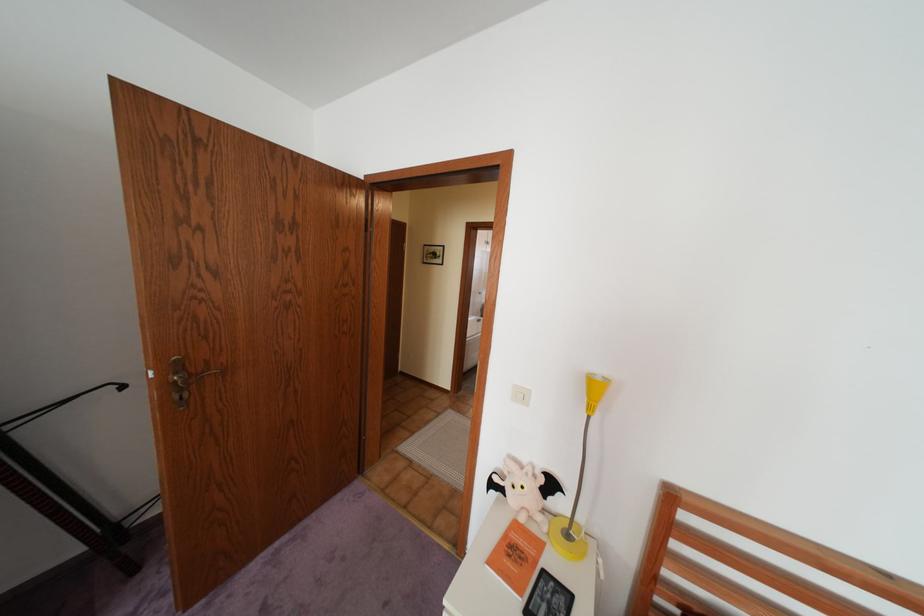
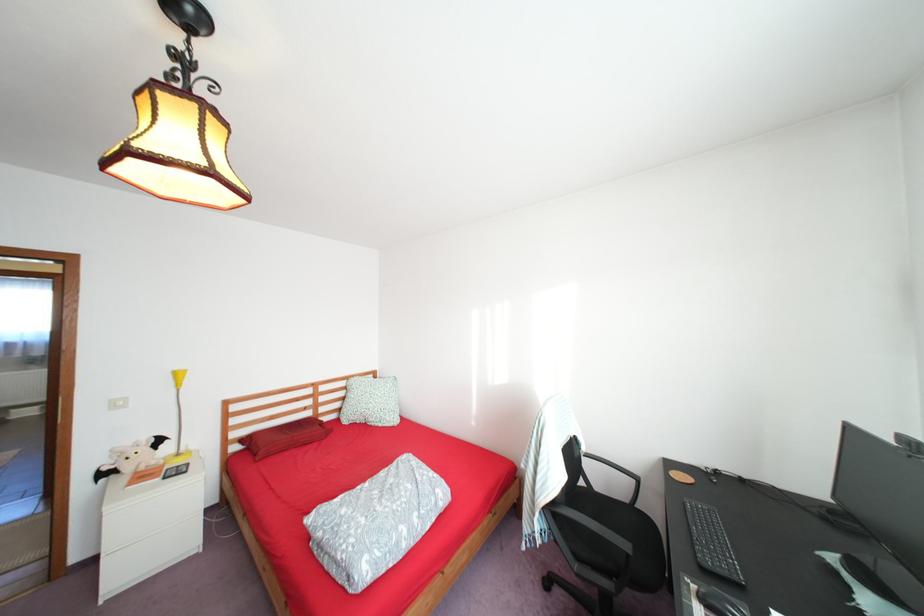
The point at (506,477) is marked in the first image. Where is the corresponding point in the second image?

(116, 468)